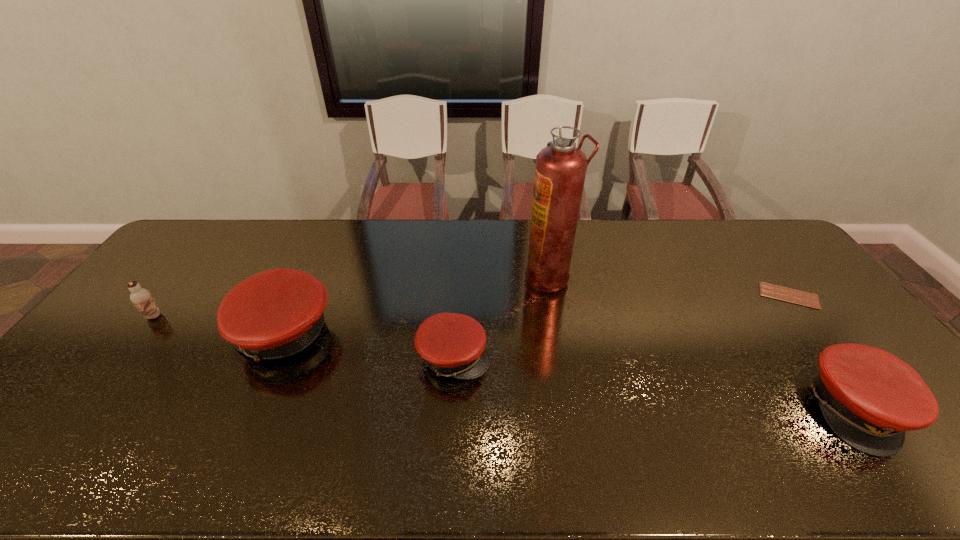
Identify the location of the leftmost cap. This screenshot has height=540, width=960. (277, 313).

The width and height of the screenshot is (960, 540). In order to click on the second object from left to right in this screenshot , I will do `click(277, 313)`.

Find the location of a particular element. Image resolution: width=960 pixels, height=540 pixels. the shortest cap is located at coordinates (451, 344).

At what (x,y) coordinates should I click in order to perform the action: click on the second cap from right to left. Please return your answer as a coordinate pair (x, y). Looking at the image, I should click on (451, 344).

This screenshot has height=540, width=960. I want to click on the fourth tallest object, so click(x=869, y=397).

The image size is (960, 540). I want to click on the second tallest cap, so click(x=869, y=397).

Locate an element on the screen. The width and height of the screenshot is (960, 540). chocolate bar is located at coordinates (794, 296).

Find the location of a particular element. the tallest object is located at coordinates (560, 170).

Identify the location of fire extinguisher. (560, 170).

Locate an element on the screen. This screenshot has width=960, height=540. chocolate milk is located at coordinates (141, 298).